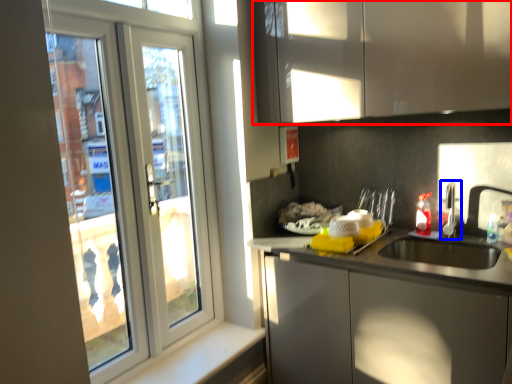
Question: Which of the following is the farthest to the observer, cabinetry (highlighted by a red box) or tap (highlighted by a blue box)?

Choices:
 (A) cabinetry
 (B) tap

Answer: (B)